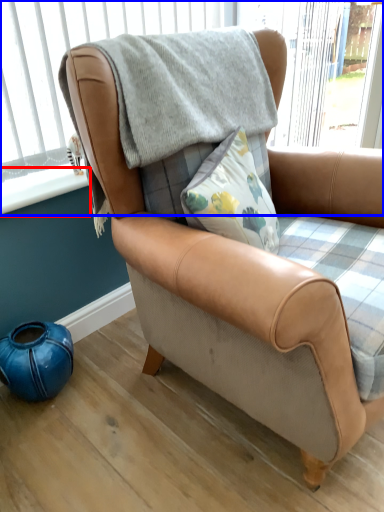
Question: Among these objects, which one is farthest to the camera, window sill (highlighted by a red box) or window frame (highlighted by a blue box)?

Choices:
 (A) window sill
 (B) window frame

Answer: (A)